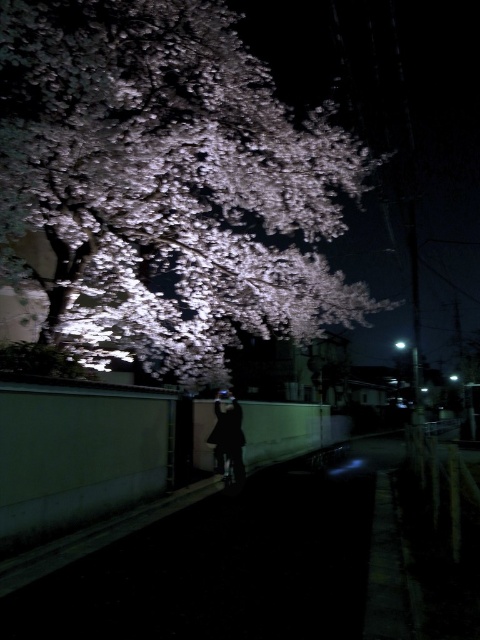
Who is more distant from viewer, (276,298) or (232,419)?

The point (276,298) is more distant.

Who is higher up, white blossoms at upper left or black matte coat at center?

Positioned higher is white blossoms at upper left.

Between point (314, 228) and point (216, 429), which one is positioned in front?

Point (216, 429) is in front.

Where is `white blossoms at upper left`? Image resolution: width=480 pixels, height=640 pixels. white blossoms at upper left is located at coordinates (167, 182).